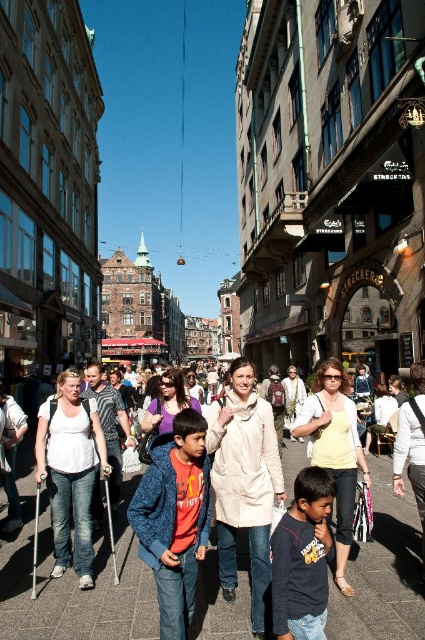
Question: Is blue fleece jacket at center to the right of dark blue cotton shirt at center from the viewer's perspective?

Choices:
 (A) no
 (B) yes

Answer: (A)

Question: Considering the real-world distances, which object is farthest from the smooth concrete pavement at center?

Choices:
 (A) blue fleece jacket at center
 (B) dark blue cotton shirt at center

Answer: (B)

Question: Is smooth concrete pavement at center thinner than dark blue cotton shirt at center?

Choices:
 (A) no
 (B) yes

Answer: (A)

Question: Which object is the farthest from the blue fleece jacket at center?

Choices:
 (A) dark blue cotton shirt at center
 (B) smooth concrete pavement at center

Answer: (A)

Question: Is the position of blue fleece jacket at center less distant than that of dark blue cotton shirt at center?

Choices:
 (A) no
 (B) yes

Answer: (A)

Question: Which of the following is the farthest from the observer?

Choices:
 (A) click(x=19, y=595)
 (B) click(x=331, y=486)
 (C) click(x=144, y=531)

Answer: (A)